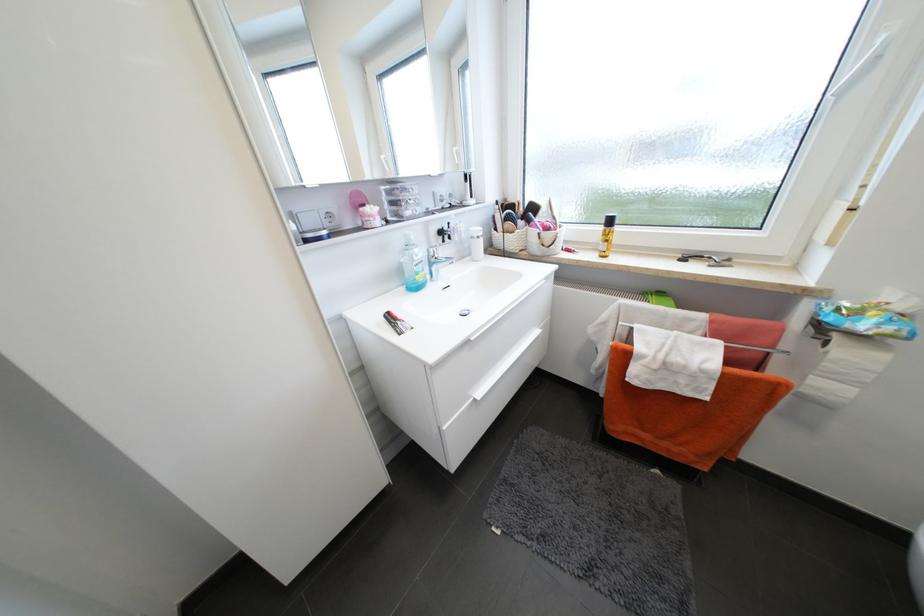
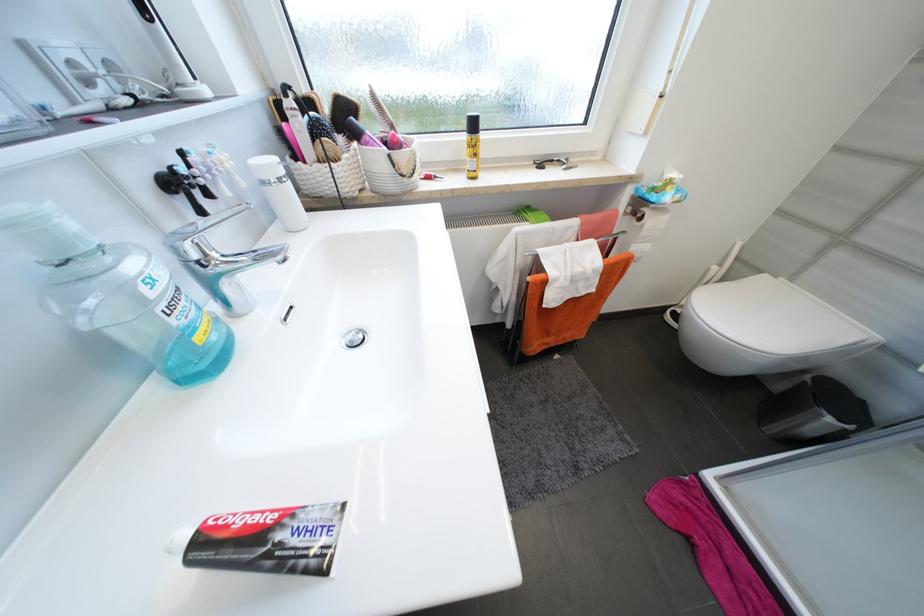
The images are taken continuously from a first-person perspective. In which direction is your viewpoint rotating?

The camera rotated toward right-down.